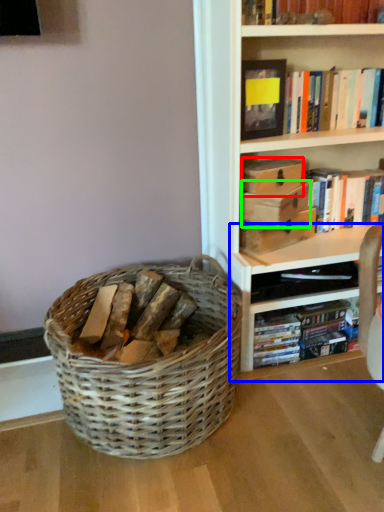
Question: Considering the real-world distances, which object is closest to storage box (highlighted by a red box)? shelf (highlighted by a blue box) or storage box (highlighted by a green box).

Choices:
 (A) shelf
 (B) storage box

Answer: (B)